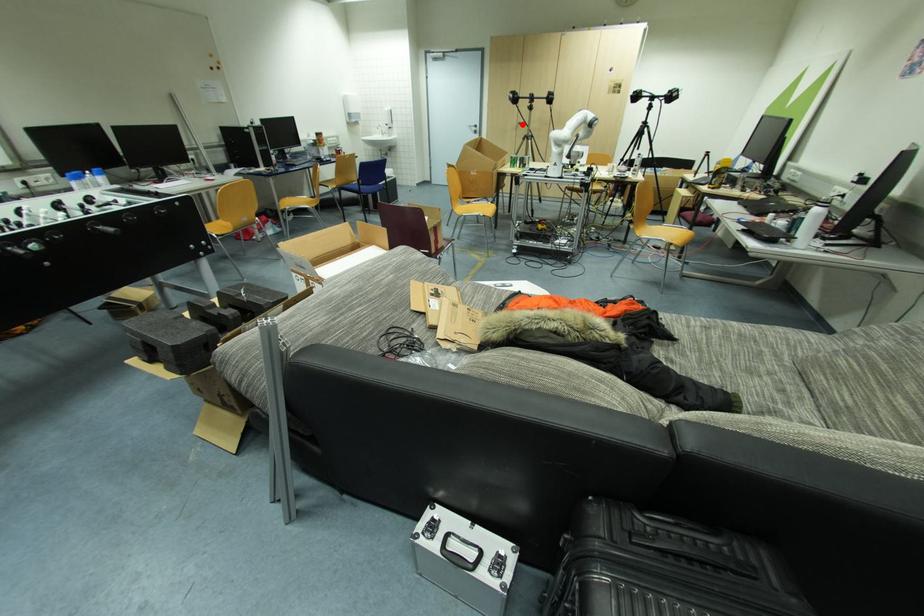
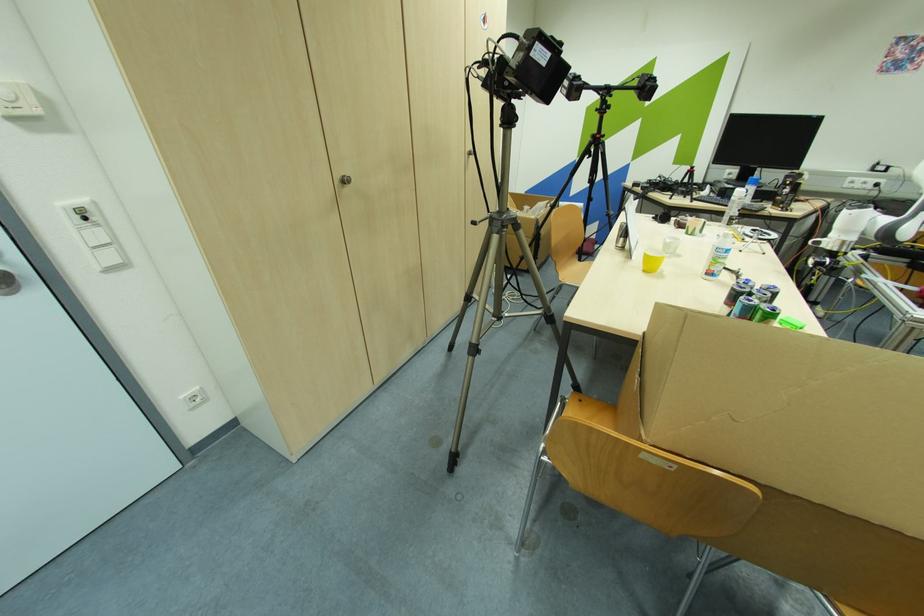
Question: I am providing you with two images of the same scene from different viewpoints. Image1 has a red point marked. In image2, the corresponding 3D location appears at what relative position? Reply with the corresponding letter.

Choices:
 (A) Closer
 (B) Farther

Answer: (B)